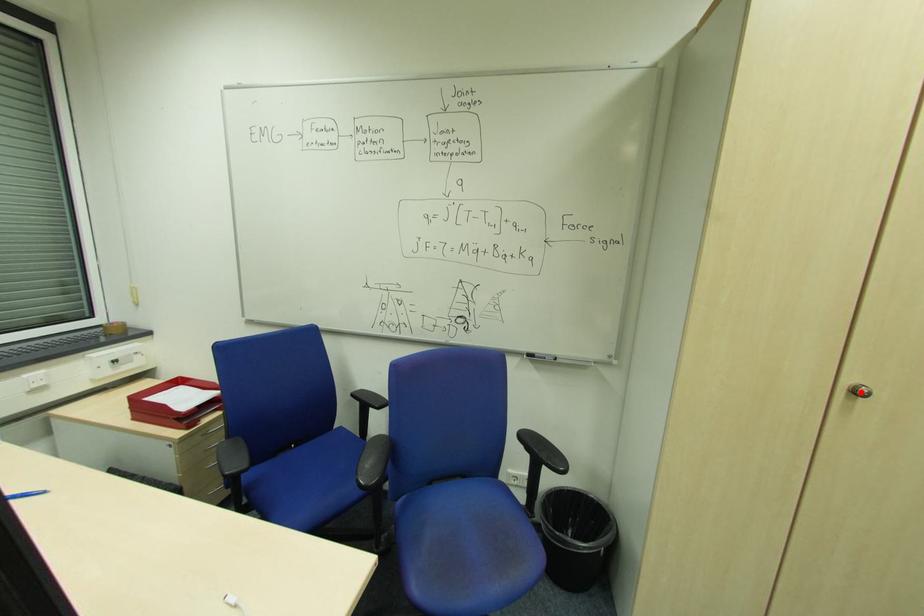
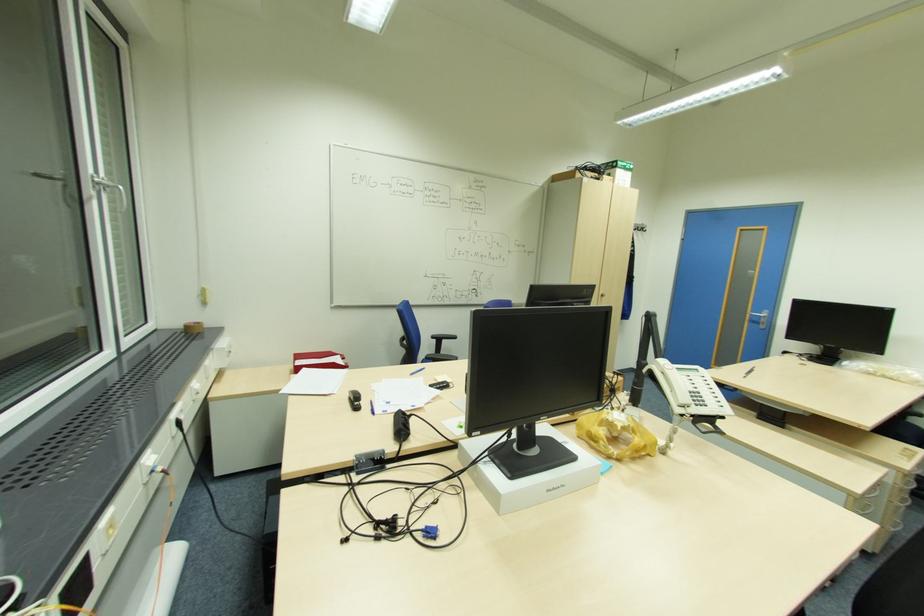
Question: I am providing you with two images of the same scene from different viewpoints. Given a red point in image1, look at the same physical point in image2. Is it:

Choices:
 (A) Closer to the viewpoint
 (B) Farther from the viewpoint

Answer: (B)